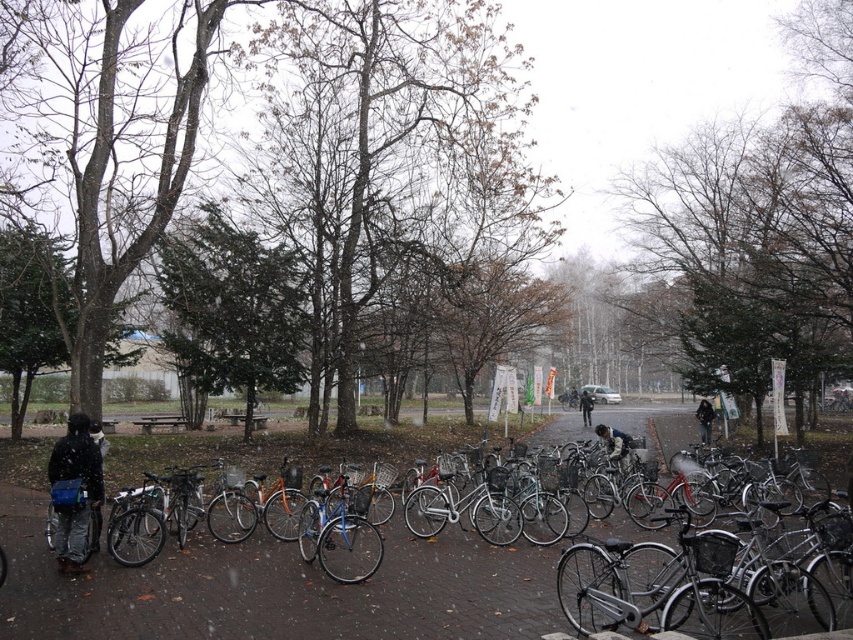
Question: Which point is farther to the camera?

Choices:
 (A) (582, 404)
 (B) (73, 420)
 (C) (680, 548)
 (D) (352, 524)

Answer: (A)

Question: Which of the following is the farthest from the observer?

Choices:
 (A) dark blue jacket at center
 (B) dark gray fabric jacket at center
 (C) shiny black bicycle at lower right

Answer: (A)

Question: Is shiny black bicycle at lower right behind shiny blue bicycle at center?

Choices:
 (A) yes
 (B) no

Answer: (B)

Question: Which of these objects is positioned farthest from the smooth concrete pavement at center?

Choices:
 (A) dark gray jacket at center-right
 (B) matte black jacket at left

Answer: (A)

Question: Does smooth concrete pavement at center appear over dark gray jacket at center-right?

Choices:
 (A) no
 (B) yes

Answer: (B)

Question: Can you confirm if smooth concrete pavement at center is positioned below dark gray jacket at center-right?

Choices:
 (A) no
 (B) yes

Answer: (A)